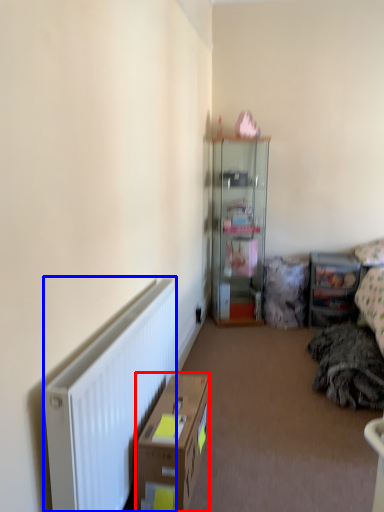
Question: Which point is closer to the camera, cardboard box (highlighted by a red box) or radiator (highlighted by a blue box)?

Choices:
 (A) cardboard box
 (B) radiator

Answer: (B)